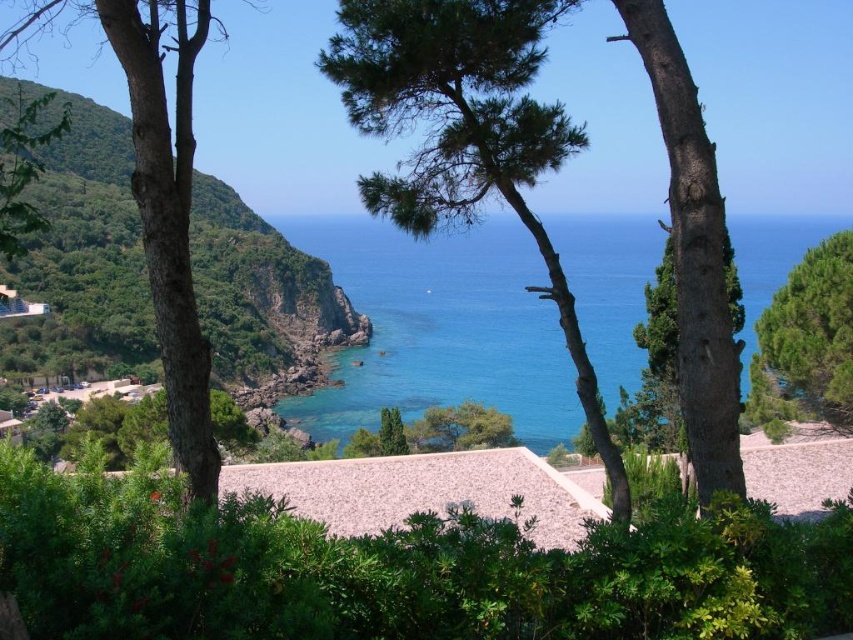
Question: Does smooth brown tree trunk at left appear under smooth brown tree trunk at right?

Choices:
 (A) no
 (B) yes

Answer: (A)

Question: Can you confirm if blue water at center is smaller than green textured pine tree at center?

Choices:
 (A) no
 (B) yes

Answer: (A)

Question: Which point is closer to the camera?

Choices:
 (A) (727, 442)
 (B) (750, 410)
 (C) (467, 28)

Answer: (A)

Question: Which of the following is the closest to the observer?

Choices:
 (A) (706, 276)
 (B) (427, 419)

Answer: (A)

Question: Does blue water at center appear on the left side of green textured tree at right?

Choices:
 (A) no
 (B) yes

Answer: (A)

Question: Which is farther from the blue water at center?

Choices:
 (A) green textured tree at right
 (B) green textured pine tree at center
 (C) smooth brown tree trunk at left

Answer: (A)